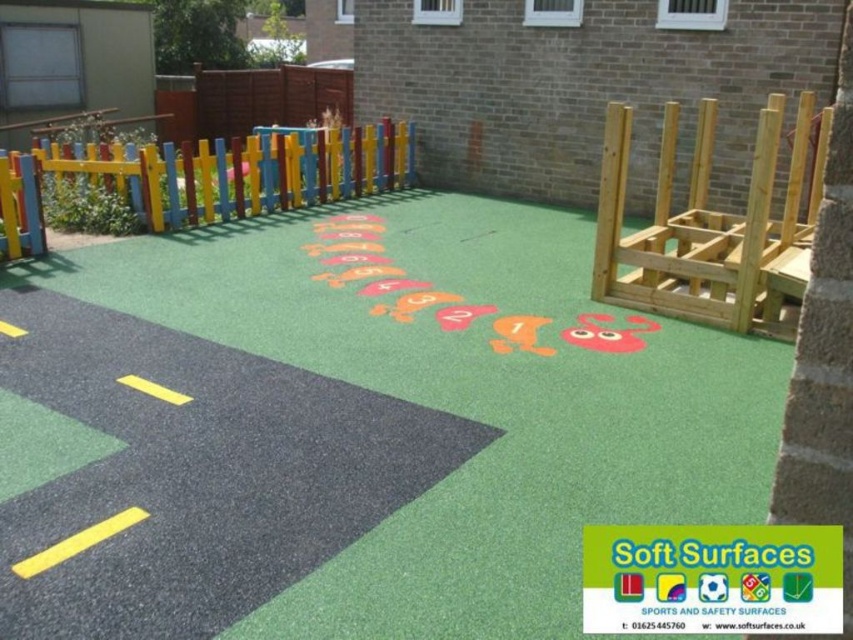
You are designing a new play area and need to know the spatial relationship between the green rubberized playground surface at center and the multicolored wooden fence at upper left. Which one is wider?

The green rubberized playground surface at center is less than the multicolored wooden fence at upper left in width, so the multicolored wooden fence at upper left is wider.

You are a small toy car that is 1 meter long. You want to drive from the black asphalt road at lower left to the green rubberized playground surface at center. Can you make the journey without stopping?

The distance between the black asphalt road at lower left and the green rubberized playground surface at center is 1.05 meters. Since the toy car is 1 meter long, it can make the journey without stopping as the distance is slightly longer than the car.

You are a parent trying to ensure your child stays within the play area. The safety guidelines state that the play area must be enclosed by a fence at least 1.5 meters away from any hazardous zones. Given the distance between the black asphalt road at lower left and the multicolored wooden fence at upper left, can you confirm if the fence is positioned safely according to the guidelines?

The black asphalt road at lower left is 4.17 meters from the multicolored wooden fence at upper left. Since the safety guidelines require the fence to be at least 1.5 meters away from hazardous zones, the current distance of 4.17 meters exceeds the minimum requirement. Therefore, the fence is positioned safely according to the guidelines.